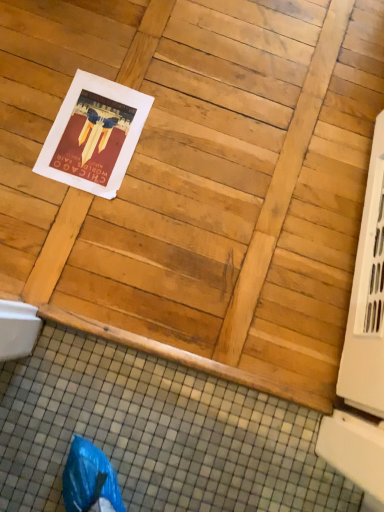
Where is `vacant region below white paper poster at upper left (from a real-world perspective)`? The height and width of the screenshot is (512, 384). vacant region below white paper poster at upper left (from a real-world perspective) is located at coordinates (95, 137).